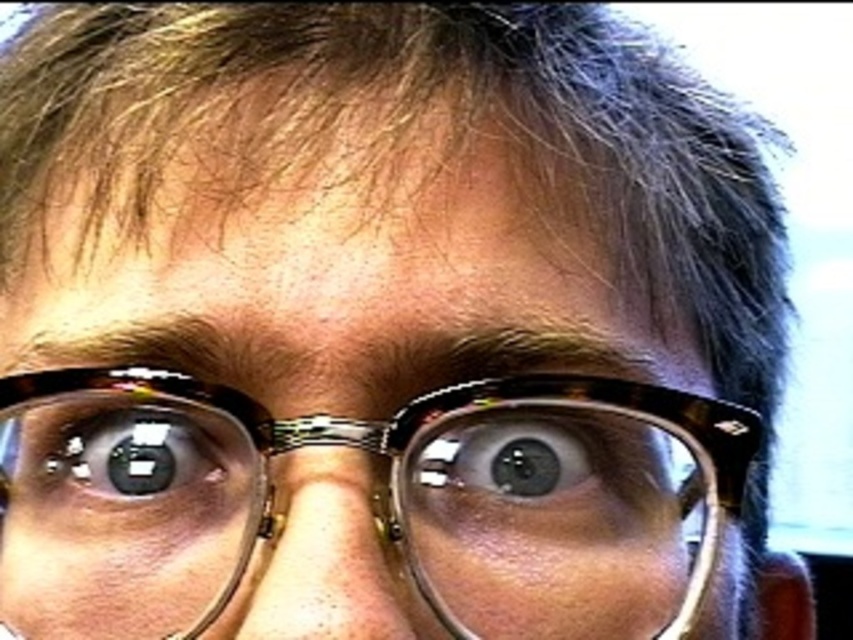
How much distance is there between matte plastic nose at center and matte black eye at center?

matte plastic nose at center and matte black eye at center are 1.61 inches apart.

Where is `matte plastic nose at center`? Image resolution: width=853 pixels, height=640 pixels. matte plastic nose at center is located at coordinates (326, 561).

The width and height of the screenshot is (853, 640). What are the coordinates of `matte plastic nose at center` in the screenshot? It's located at (326, 561).

Who is positioned more to the left, brown glossy eye at center or matte black eye at center?

matte black eye at center

Does brown glossy eye at center have a smaller size compared to matte black eye at center?

Yes, brown glossy eye at center is smaller than matte black eye at center.

Locate an element on the screen. The image size is (853, 640). brown glossy eye at center is located at coordinates [x=517, y=452].

Is matte plastic nose at center behind brown glossy eye at center?

No, matte plastic nose at center is closer to the viewer.

Between matte plastic nose at center and brown glossy eye at center, which one appears on the right side from the viewer's perspective?

brown glossy eye at center is more to the right.

Locate an element on the screen. matte plastic nose at center is located at coordinates (326, 561).